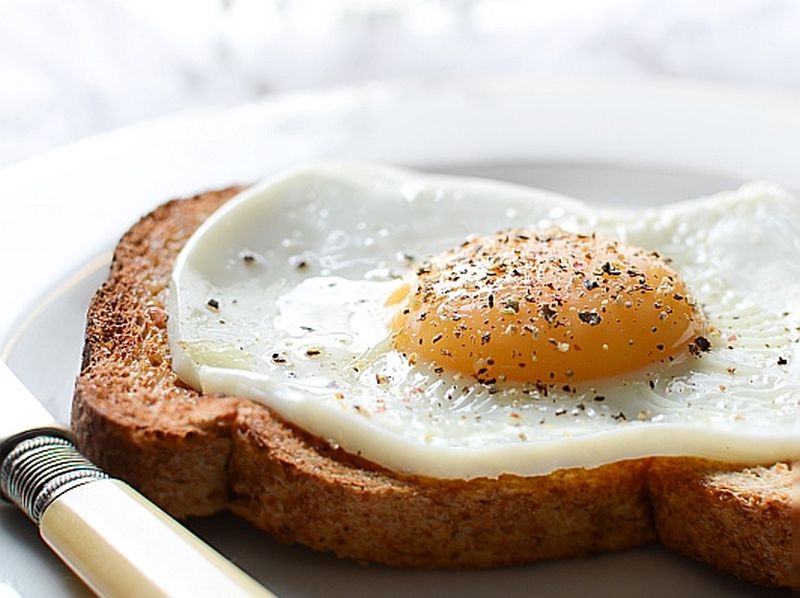
Where is `plate`? plate is located at coordinates (169, 164).